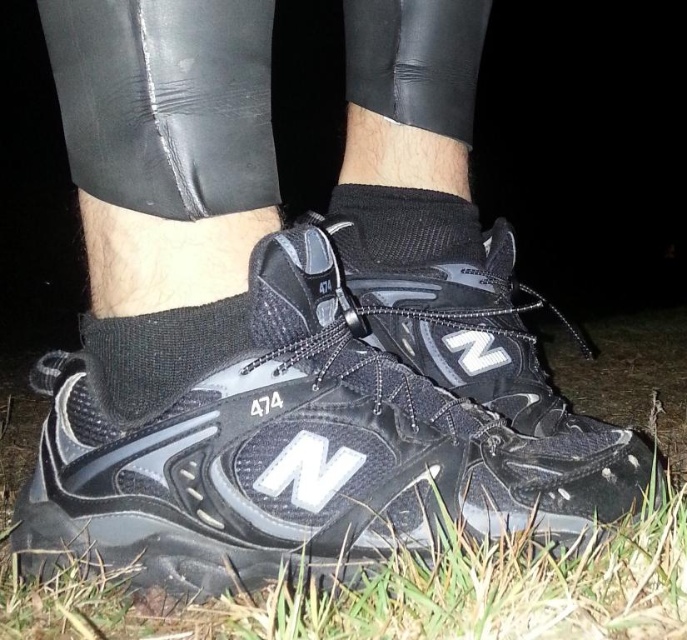
Is the position of black mesh sock at lower center more distant than that of black mesh sock at center?

No, black mesh sock at lower center is closer to the viewer.

This screenshot has width=687, height=640. What do you see at coordinates (157, 355) in the screenshot?
I see `black mesh sock at lower center` at bounding box center [157, 355].

Where is `black mesh sock at lower center`? This screenshot has width=687, height=640. black mesh sock at lower center is located at coordinates (157, 355).

You are a GUI agent. You are given a task and a screenshot of the screen. Output one action in this format:
    pyautogui.click(x=<x>, y=<y>)
    Task: Click on the black mesh sock at lower center
    This screenshot has height=640, width=687.
    Given the screenshot: What is the action you would take?
    pyautogui.click(x=157, y=355)

Is black mesh shoe at center taller than black mesh sock at center?

Yes.

In the scene shown: Is black mesh shoe at center to the left of black mesh sock at center from the viewer's perspective?

Correct, you'll find black mesh shoe at center to the left of black mesh sock at center.

Does point (442, 483) lie behind point (365, 244)?

No, (442, 483) is closer to viewer.

Where is `black mesh shoe at center`? black mesh shoe at center is located at coordinates (326, 435).

Who is more forward, [319,224] or [218,348]?

Point [218,348]

Does black mesh shoe at center have a larger size compared to black mesh sock at lower center?

Yes, black mesh shoe at center is bigger than black mesh sock at lower center.

In order to click on black mesh shoe at center in this screenshot , I will do 326,435.